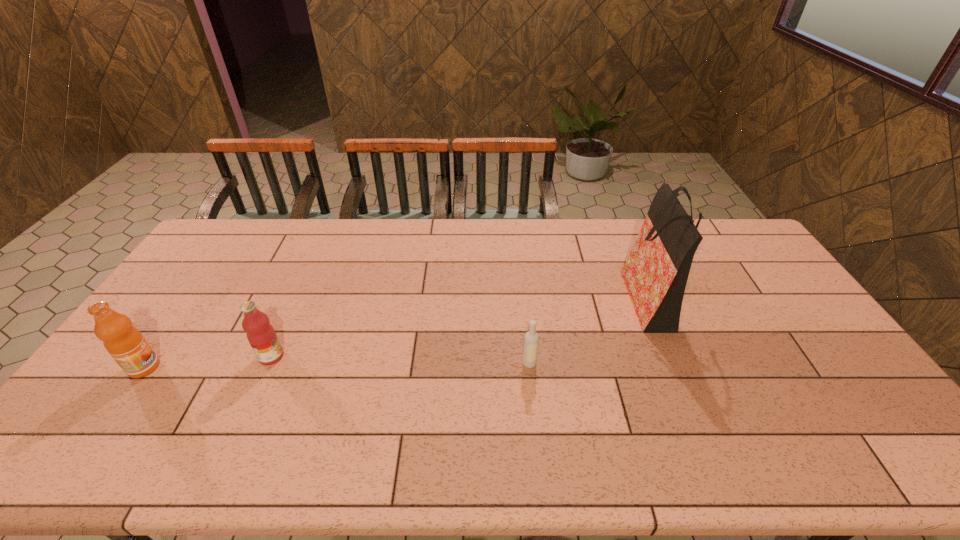
This screenshot has height=540, width=960. What are the coordinates of `empty space between the leftmost object and the vodka` in the screenshot? It's located at (337, 366).

The height and width of the screenshot is (540, 960). Find the location of `vacant area that lies between the shortest object and the left fruit juice`. vacant area that lies between the shortest object and the left fruit juice is located at coordinates (337, 366).

Locate an element on the screen. The image size is (960, 540). vacant point located between the right fruit juice and the left fruit juice is located at coordinates (207, 362).

Where is `vacant area that lies between the third object from right to left and the farthest object`? This screenshot has width=960, height=540. vacant area that lies between the third object from right to left and the farthest object is located at coordinates (460, 326).

Find the location of a particular element. The height and width of the screenshot is (540, 960). free space that is in between the shortest object and the leftmost object is located at coordinates (337, 366).

Find the location of `vacant area that lies between the second object from left to right and the leftmost object`. vacant area that lies between the second object from left to right and the leftmost object is located at coordinates (207, 362).

Find the location of a particular element. The width and height of the screenshot is (960, 540). free space between the farthest object and the third tallest object is located at coordinates (460, 326).

This screenshot has width=960, height=540. I want to click on free space between the vodka and the second object from left to right, so click(x=400, y=360).

Identify which object is located as the second nearest to the second object from right to left. Please provide its 2D coordinates. Your answer should be formatted as a tuple, i.e. [(x, y)], where the tuple contains the x and y coordinates of a point satisfying the conditions above.

[(261, 335)]

Where is `object that is the second closest to the third object from right to left`? object that is the second closest to the third object from right to left is located at coordinates (531, 340).